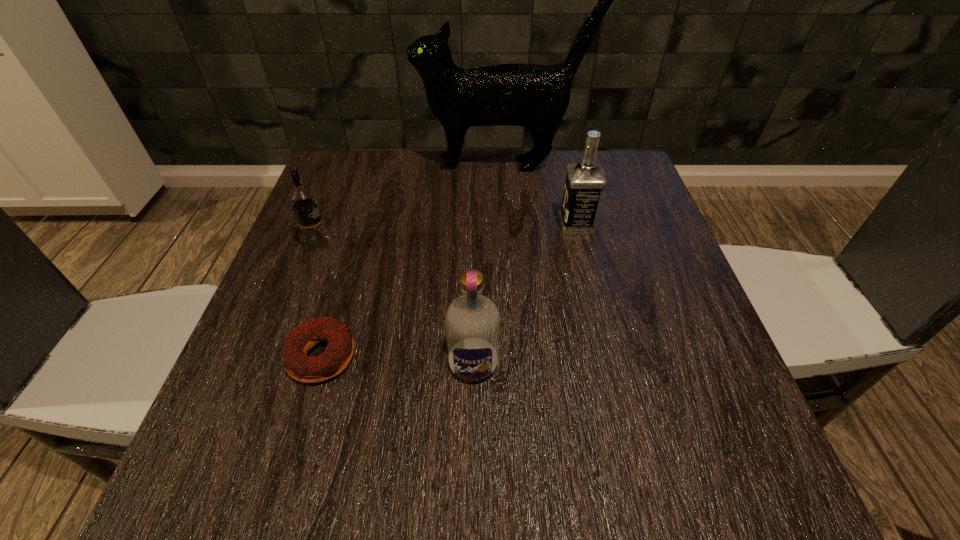
Where is `free location located on the face of the cat`? This screenshot has width=960, height=540. free location located on the face of the cat is located at coordinates (330, 165).

I want to click on vacant position located 0.210m on the front label of the rightmost vodka, so click(x=466, y=225).

Identify the location of blank space located 0.120m on the front label of the rightmost vodka. This screenshot has width=960, height=540. (506, 225).

At what (x,y) coordinates should I click in order to perform the action: click on vacant region located 0.160m on the front label of the rightmost vodka. Please return your answer as a coordinate pair (x, y). This screenshot has width=960, height=540. Looking at the image, I should click on (488, 225).

Identify the location of free space located on the label of the nearest vodka. This screenshot has height=540, width=960. (472, 469).

Identify the location of vacant area situated on the label of the leftmost vodka. (507, 244).

I want to click on free space located on the back of the doughnut, so click(352, 255).

The height and width of the screenshot is (540, 960). What are the coordinates of `object present at the far edge` in the screenshot? It's located at (536, 97).

Locate an element on the screen. vodka that is positioned at the left edge is located at coordinates (303, 201).

What are the coordinates of `doughnut that is positioned at the left edge` in the screenshot? It's located at (339, 352).